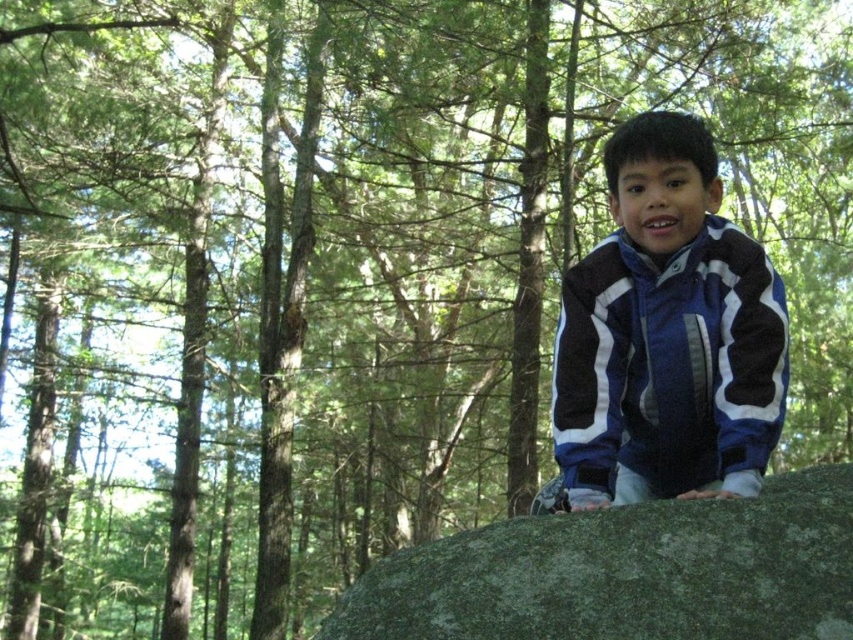
Who is positioned more to the left, blue fleece jacket at center or green mossy boulder at center?

blue fleece jacket at center

Looking at this image, can you confirm if blue fleece jacket at center is thinner than green mossy boulder at center?

Correct, blue fleece jacket at center's width is less than green mossy boulder at center's.

Which is behind, point (764, 467) or point (425, 582)?

The point (764, 467) is more distant.

Where is `blue fleece jacket at center`? blue fleece jacket at center is located at coordinates 666,333.